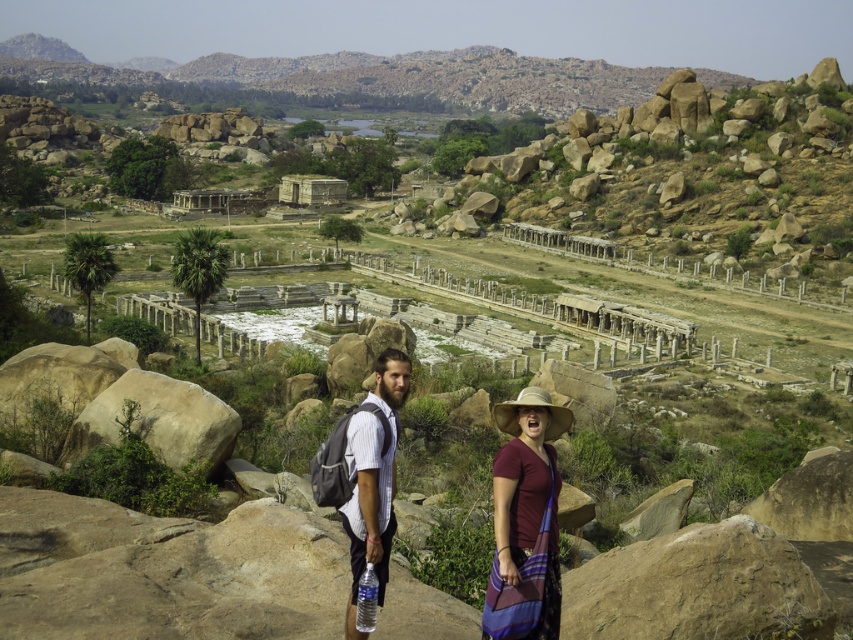
Which is in front, point (88, 67) or point (558, 428)?

Point (558, 428)

Is rocky terrain at upper center closer to camera compared to maroon fabric shirt at center?

No, rocky terrain at upper center is further to the viewer.

Where is `rocky terrain at upper center`? rocky terrain at upper center is located at coordinates (370, 76).

Can you confirm if matte white shirt at center is positioned above straw hat at center?

Yes.

Is matte white shirt at center to the left of straw hat at center from the viewer's perspective?

Correct, you'll find matte white shirt at center to the left of straw hat at center.

This screenshot has height=640, width=853. I want to click on matte white shirt at center, so click(x=373, y=480).

You are a GUI agent. You are given a task and a screenshot of the screen. Output one action in this format:
    pyautogui.click(x=<x>, y=<y>)
    Task: Click on the matte white shirt at center
    The image size is (853, 640).
    Given the screenshot: What is the action you would take?
    pyautogui.click(x=373, y=480)

Measure the distance between point (355, 496) and camera.

They are 157.93 feet apart.

Which is behind, point (384, 353) or point (515, 403)?

The point (384, 353) is behind.

The height and width of the screenshot is (640, 853). What do you see at coordinates (368, 508) in the screenshot?
I see `striped cotton shirt at center` at bounding box center [368, 508].

Find the location of a particular element. The width and height of the screenshot is (853, 640). striped cotton shirt at center is located at coordinates (368, 508).